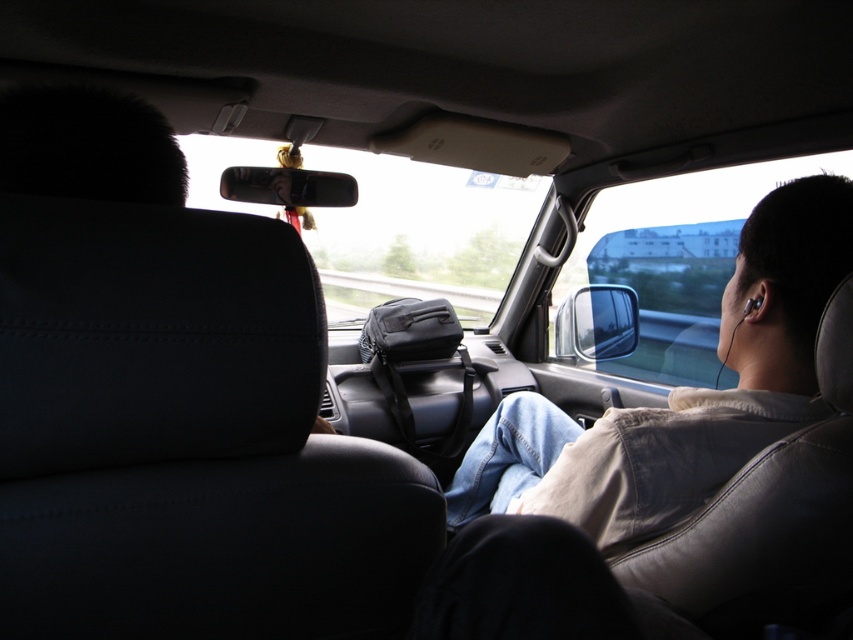
Which is behind, point (782, 273) or point (90, 188)?

The point (782, 273) is behind.

Between light brown leather jacket at right and black fur at upper left, which one is positioned lower?

light brown leather jacket at right is lower down.

At what (x,y) coordinates should I click in order to perform the action: click on light brown leather jacket at right. Please return your answer as a coordinate pair (x, y). The image size is (853, 640). Looking at the image, I should click on (680, 394).

Find the location of `light brown leather jacket at right`. light brown leather jacket at right is located at coordinates (680, 394).